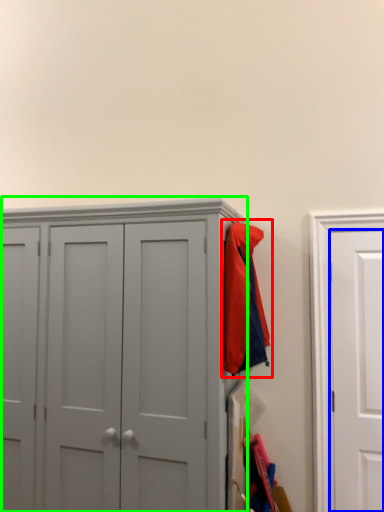
Question: Estimate the real-world distances between objects in this image. Which object is farther from jacket (highlighted by a red box), door (highlighted by a blue box) or cupboard (highlighted by a green box)?

Choices:
 (A) door
 (B) cupboard

Answer: (A)